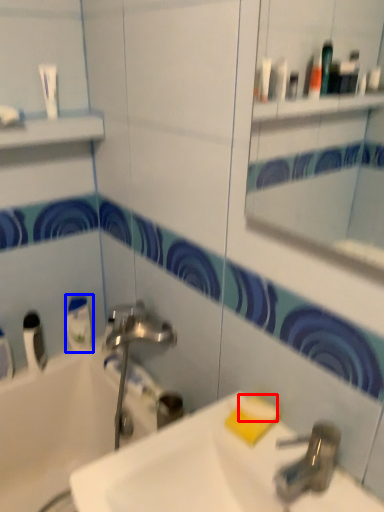
Question: Which object appears farthest to the camera in this image, soap (highlighted by a red box) or mouthwash (highlighted by a blue box)?

Choices:
 (A) soap
 (B) mouthwash

Answer: (B)